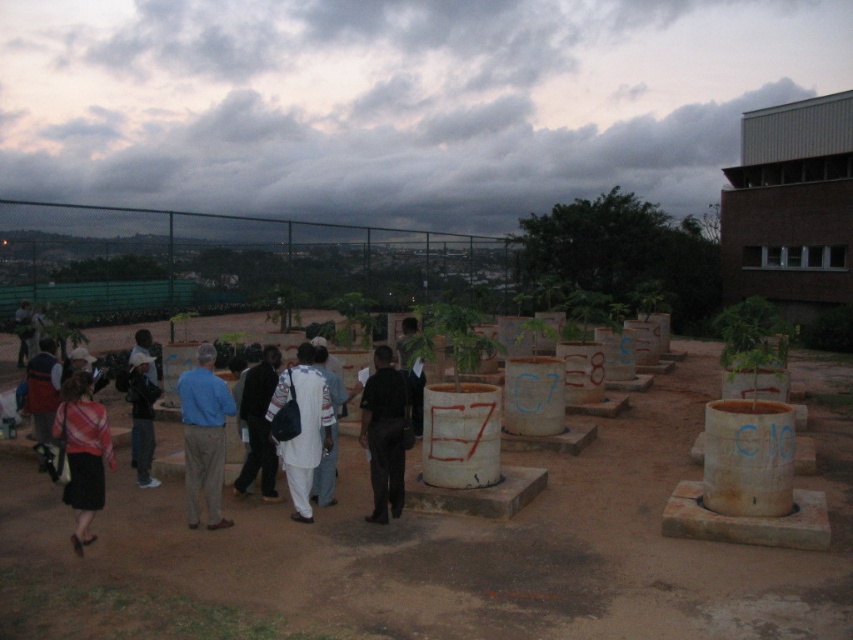
Looking at this image, you are standing at the center of the outdoor scene and want to greet the person wearing the dark blue shirt at center and the light brown leather jacket at center. If you can comfortably extend your arms to a maximum reach of 10 feet, can you shake hands with both individuals simultaneously?

The dark blue shirt at center is 10.46 feet away from the light brown leather jacket at center. Since your maximum reach is 10 feet, you cannot simultaneously shake hands with both individuals as the distance between them exceeds your reach.

You are standing at the point labeled point (27,381) and want to walk to the point labeled point (611,531). Which direction should you move relative to your current position?

You should move forward because point (611,531) is in front of point (27,381).

You are standing in the dusk scene with heavy clouds. You see a brown dirt field at center and a dark blue shirt at center. Which object is positioned to the right of the other?

The brown dirt field at center is to the right of the dark blue shirt at center.